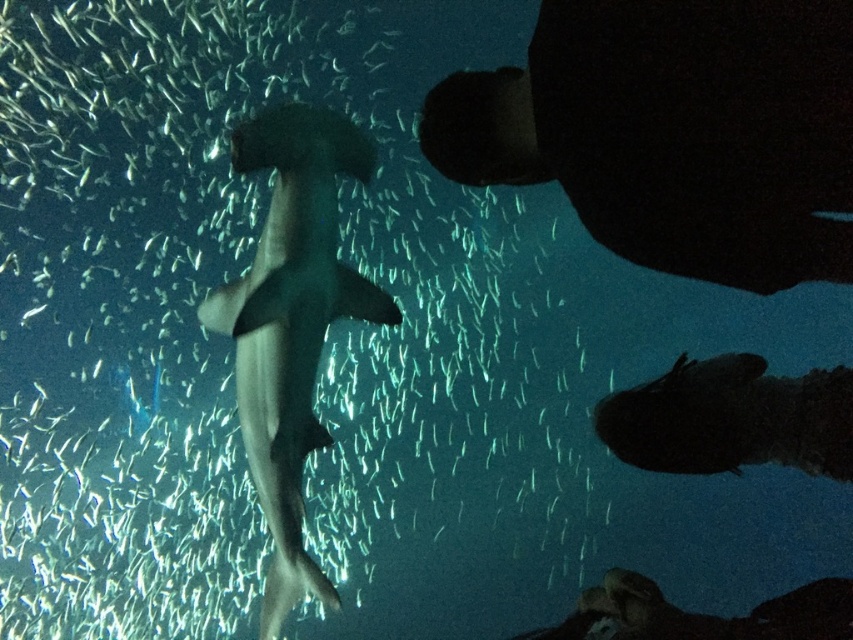
From the picture: Is the position of translucent gray shark at center less distant than that of black matte diver at upper center?

No, it is not.

This screenshot has width=853, height=640. Describe the element at coordinates (231, 342) in the screenshot. I see `translucent gray shark at center` at that location.

The height and width of the screenshot is (640, 853). Identify the location of translucent gray shark at center. (231, 342).

Looking at this image, is translucent gray shark at center positioned at the back of gray matte shark at center?

Yes.

Between translucent gray shark at center and gray matte shark at center, which one is positioned lower?

gray matte shark at center

The width and height of the screenshot is (853, 640). Identify the location of translucent gray shark at center. (231, 342).

Can you confirm if black matte diver at upper center is positioned to the left of gray matte shark at center?

In fact, black matte diver at upper center is to the right of gray matte shark at center.

Identify the location of black matte diver at upper center. (674, 131).

You are a GUI agent. You are given a task and a screenshot of the screen. Output one action in this format:
    pyautogui.click(x=<x>, y=<y>)
    Task: Click on the black matte diver at upper center
    The width and height of the screenshot is (853, 640).
    Given the screenshot: What is the action you would take?
    pyautogui.click(x=674, y=131)